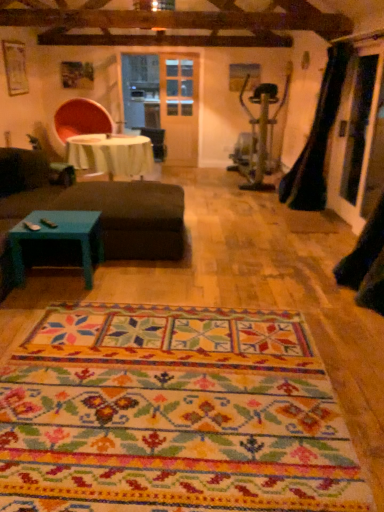
Question: Is white fabric table at center wider than black leather guitar case at right?

Choices:
 (A) yes
 (B) no

Answer: (A)

Question: From the image's perspective, is white fabric table at center located above black leather guitar case at right?

Choices:
 (A) no
 (B) yes

Answer: (A)

Question: Is white fabric table at center to the right of black leather guitar case at right from the viewer's perspective?

Choices:
 (A) no
 (B) yes

Answer: (A)

Question: From a real-world perspective, is white fabric table at center physically below black leather guitar case at right?

Choices:
 (A) no
 (B) yes

Answer: (B)

Question: From a real-world perspective, is white fabric table at center on black leather guitar case at right?

Choices:
 (A) yes
 (B) no

Answer: (B)

Question: From a real-world perspective, is black leather guitar case at right physically located above or below white fabric table at center?

Choices:
 (A) above
 (B) below

Answer: (A)

Question: Is black leather guitar case at right bigger or smaller than white fabric table at center?

Choices:
 (A) big
 (B) small

Answer: (B)

Question: Considering the positions of black leather guitar case at right and white fabric table at center in the image, is black leather guitar case at right wider or thinner than white fabric table at center?

Choices:
 (A) wide
 (B) thin

Answer: (B)

Question: Is point (326, 137) positioned closer to the camera than point (79, 152)?

Choices:
 (A) closer
 (B) farther

Answer: (B)

Question: From a real-world perspective, relative to multicolored woven mat at center, is white fabric table at center vertically above or below?

Choices:
 (A) above
 (B) below

Answer: (A)

Question: Is white fabric table at center wider or thinner than multicolored woven mat at center?

Choices:
 (A) thin
 (B) wide

Answer: (A)

Question: Considering the positions of white fabric table at center and multicolored woven mat at center in the image, is white fabric table at center taller or shorter than multicolored woven mat at center?

Choices:
 (A) tall
 (B) short

Answer: (A)

Question: Relative to multicolored woven mat at center, is white fabric table at center in front or behind?

Choices:
 (A) behind
 (B) front

Answer: (A)

Question: From a real-world perspective, is dark brown fabric ottoman at center physically located above or below teal painted wood coffee table at lower left?

Choices:
 (A) above
 (B) below

Answer: (A)

Question: Is dark brown fabric ottoman at center wider or thinner than teal painted wood coffee table at lower left?

Choices:
 (A) wide
 (B) thin

Answer: (A)